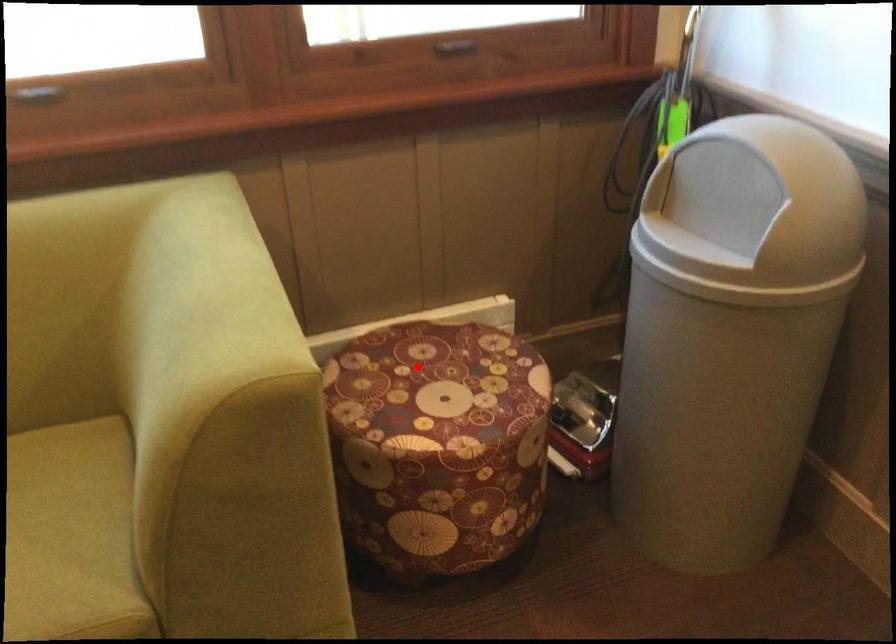
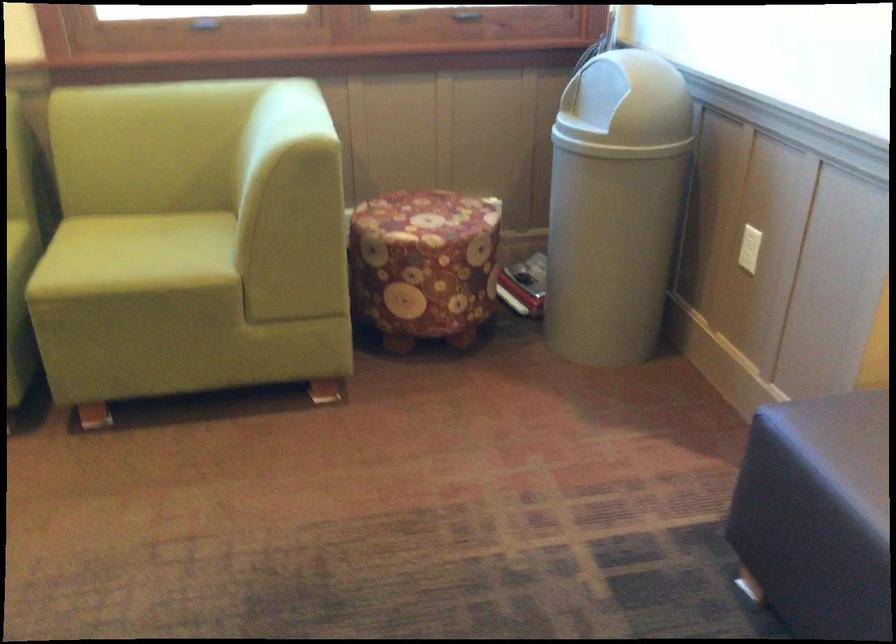
Question: I am providing you with two images of the same scene from different viewpoints. In image1, a red point is highlighted. Considering the same 3D point in image2, which of the following is correct?

Choices:
 (A) It is closer
 (B) It is farther

Answer: (B)